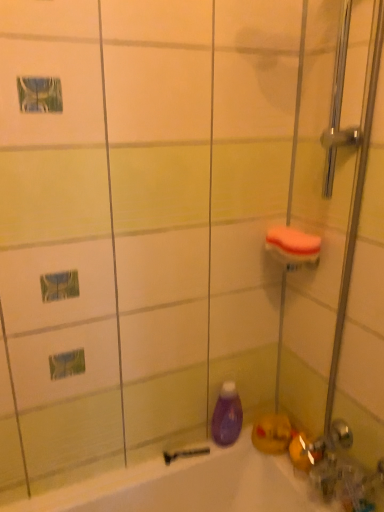
Question: Is point (286, 246) closer or farther from the camera than point (329, 436)?

Choices:
 (A) farther
 (B) closer

Answer: (B)

Question: Considering their positions, is orange sponge at upper right located in front of or behind clear glass shower door at right?

Choices:
 (A) behind
 (B) front

Answer: (A)

Question: Which object is positioned farthest from the black rubber razor at lower center?

Choices:
 (A) purple glossy bottle at lower center
 (B) clear glass shower door at right
 (C) orange sponge at upper right

Answer: (B)

Question: Based on their relative distances, which object is farther from the purple glossy bottle at lower center?

Choices:
 (A) orange sponge at upper right
 (B) clear glass shower door at right
 (C) black rubber razor at lower center

Answer: (A)